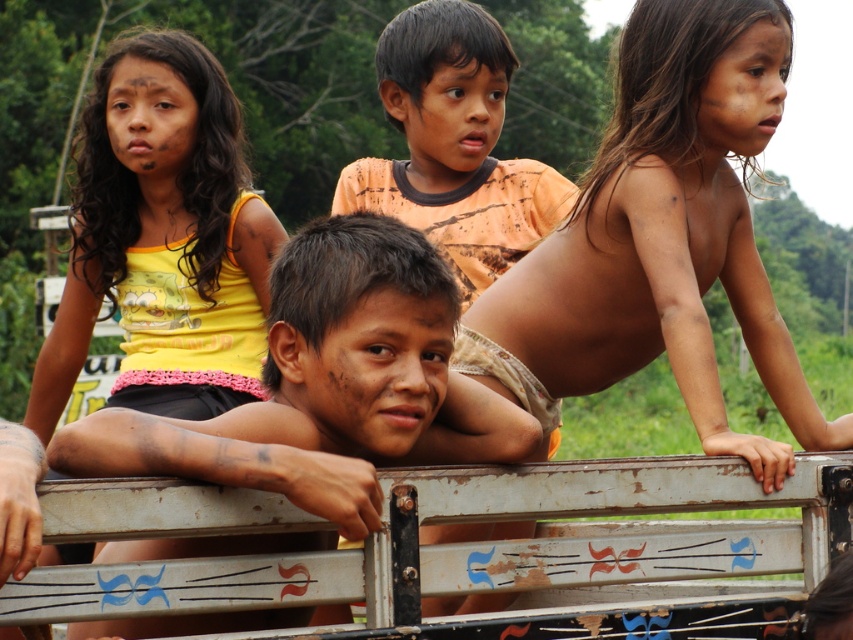
Question: Considering the relative positions of metallic painted rail at center and yellow printed tank top at upper left in the image provided, where is metallic painted rail at center located with respect to yellow printed tank top at upper left?

Choices:
 (A) below
 (B) above

Answer: (A)

Question: From the image, what is the correct spatial relationship of smooth skin girl at upper right in relation to orange t-shirt at center?

Choices:
 (A) right
 (B) left

Answer: (A)

Question: Is yellow printed tank top at upper left to the right of dark brown hair at center from the viewer's perspective?

Choices:
 (A) yes
 (B) no

Answer: (B)

Question: Which object appears farthest from the camera in this image?

Choices:
 (A) smooth skin girl at upper right
 (B) dark brown hair at center
 (C) metallic painted rail at center
 (D) orange t-shirt at center

Answer: (D)

Question: Which of the following is the farthest from the observer?

Choices:
 (A) dark brown hair at center
 (B) metallic painted rail at center

Answer: (A)

Question: Which of the following is the closest to the observer?

Choices:
 (A) dark brown hair at center
 (B) smooth skin girl at upper right
 (C) metallic painted rail at center
 (D) yellow printed tank top at upper left

Answer: (C)